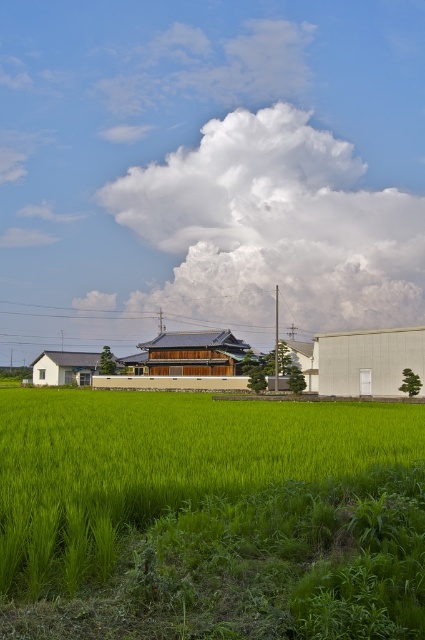
You are a photographer planning to capture the entire scene of the rural landscape. You want to ensure that both the white fluffy cloud at upper center and the green grassy field at center are clearly visible in your photo. Based on their positions, which object will appear closer to the camera in the final image?

The white fluffy cloud at upper center will appear closer to the camera in the final image because it is in front of the green grassy field at center.

You are standing in the middle of the rice fields and looking towards the traditional house. There is a point marked at coordinates (274, 227). What object is located at that point?

At point (274, 227) lies a white fluffy cloud at upper center.

You are a bird flying over the rural landscape. You see the white fluffy cloud at upper center and the green grassy field at center. Which one is higher in the sky?

The white fluffy cloud at upper center is higher in the sky than the green grassy field at center because it is located above it.